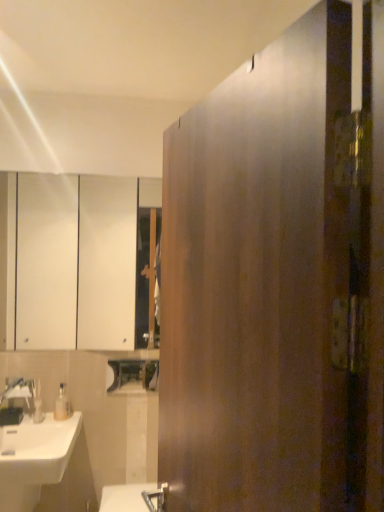
Identify the location of spots to the right of matte plastic soap dispenser at lower left. The height and width of the screenshot is (512, 384). (61, 421).